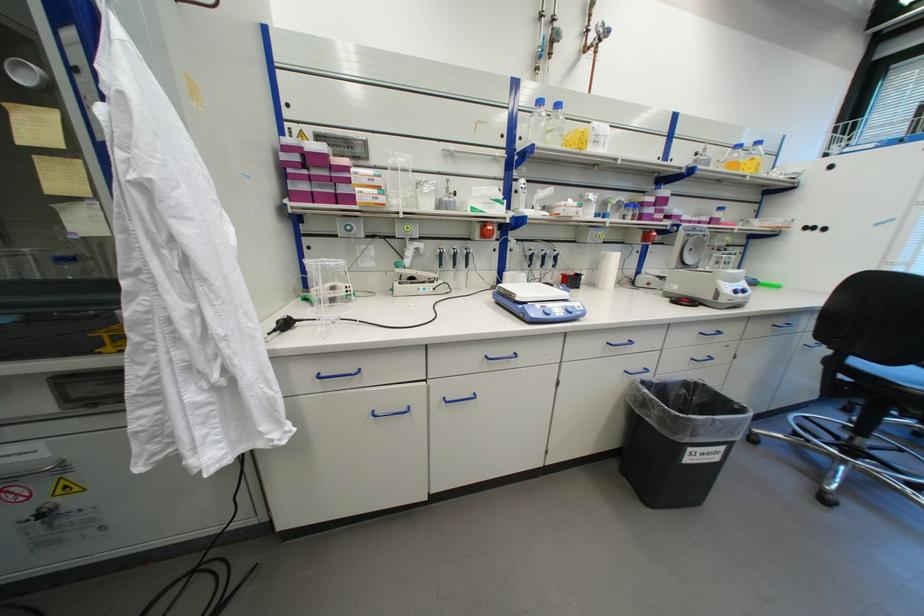
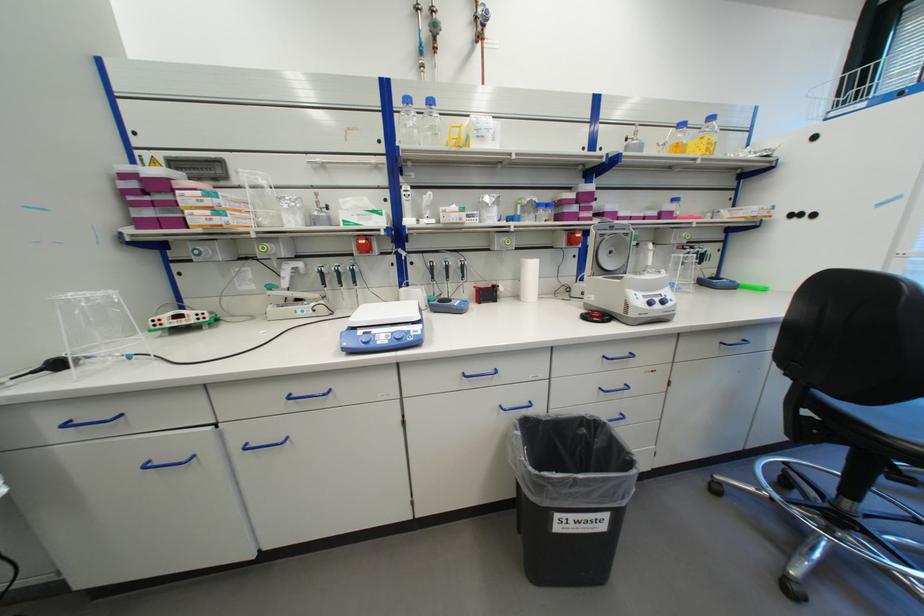
In the second image, find the point that corresponds to point (556, 105) in the first image.

(428, 103)